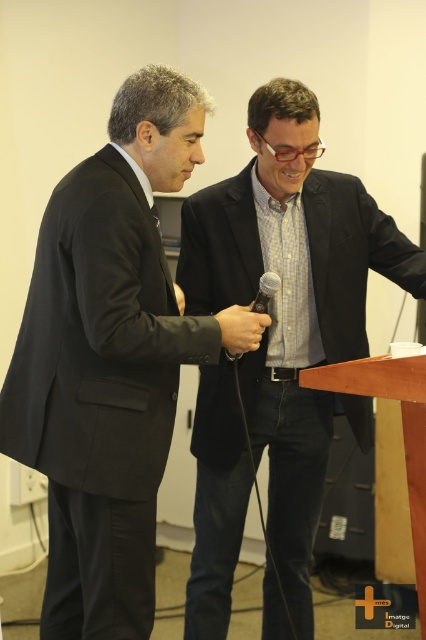
Question: Which is nearer to the matte black suit at left?

Choices:
 (A) matte black suit at center
 (B) matte black microphone at center

Answer: (A)

Question: Does matte black suit at left appear over matte black suit at center?

Choices:
 (A) no
 (B) yes

Answer: (B)

Question: Which is nearer to the matte black suit at center?

Choices:
 (A) matte black suit at left
 (B) matte black microphone at center
 (C) black matte microphone at center

Answer: (C)

Question: Does matte black suit at left have a smaller size compared to matte black microphone at center?

Choices:
 (A) no
 (B) yes

Answer: (A)

Question: Which point is farther to the camera?

Choices:
 (A) click(264, 296)
 (B) click(239, 326)

Answer: (A)

Question: Does matte black suit at center have a smaller size compared to matte black microphone at center?

Choices:
 (A) no
 (B) yes

Answer: (A)